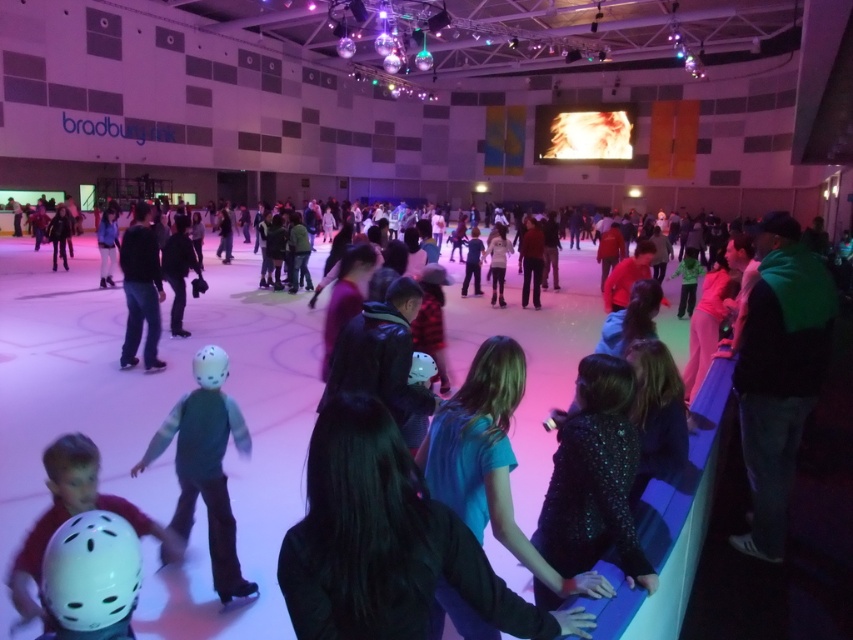
Is point (248, 444) behind point (16, 593)?

Yes, it is.

Between green fuzzy vest at center and white matte helmet at lower left, which one has less height?

Standing shorter between the two is white matte helmet at lower left.

Who is more distant from viewer, (207, 512) or (86, 477)?

Positioned behind is point (207, 512).

Where is `green fuzzy vest at center`? green fuzzy vest at center is located at coordinates (206, 465).